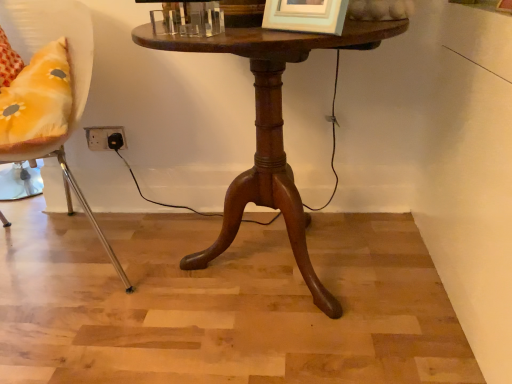
Question: From the image's perspective, is metallic yellow cushion at left above mahogany wood table at center?

Choices:
 (A) no
 (B) yes

Answer: (B)

Question: Is mahogany wood table at center at the back of metallic yellow cushion at left?

Choices:
 (A) no
 (B) yes

Answer: (A)

Question: Is metallic yellow cushion at left oriented towards mahogany wood table at center?

Choices:
 (A) no
 (B) yes

Answer: (A)

Question: Is metallic yellow cushion at left positioned behind mahogany wood table at center?

Choices:
 (A) no
 (B) yes

Answer: (A)

Question: Is metallic yellow cushion at left wider than mahogany wood table at center?

Choices:
 (A) yes
 (B) no

Answer: (A)

Question: Can you confirm if metallic yellow cushion at left is bigger than mahogany wood table at center?

Choices:
 (A) no
 (B) yes

Answer: (B)

Question: Does mahogany wood table at center come behind metallic yellow cushion at left?

Choices:
 (A) no
 (B) yes

Answer: (B)

Question: From a real-world perspective, is mahogany wood table at center on metallic yellow cushion at left?

Choices:
 (A) no
 (B) yes

Answer: (A)

Question: Is mahogany wood table at center located outside metallic yellow cushion at left?

Choices:
 (A) no
 (B) yes

Answer: (B)

Question: Are mahogany wood table at center and metallic yellow cushion at left making contact?

Choices:
 (A) no
 (B) yes

Answer: (A)

Question: From the image's perspective, is mahogany wood table at center located above metallic yellow cushion at left?

Choices:
 (A) no
 (B) yes

Answer: (A)

Question: From a real-world perspective, is mahogany wood table at center under metallic yellow cushion at left?

Choices:
 (A) no
 (B) yes

Answer: (B)

Question: Relative to mahogany wood table at center, is metallic yellow cushion at left in front or behind?

Choices:
 (A) front
 (B) behind

Answer: (A)